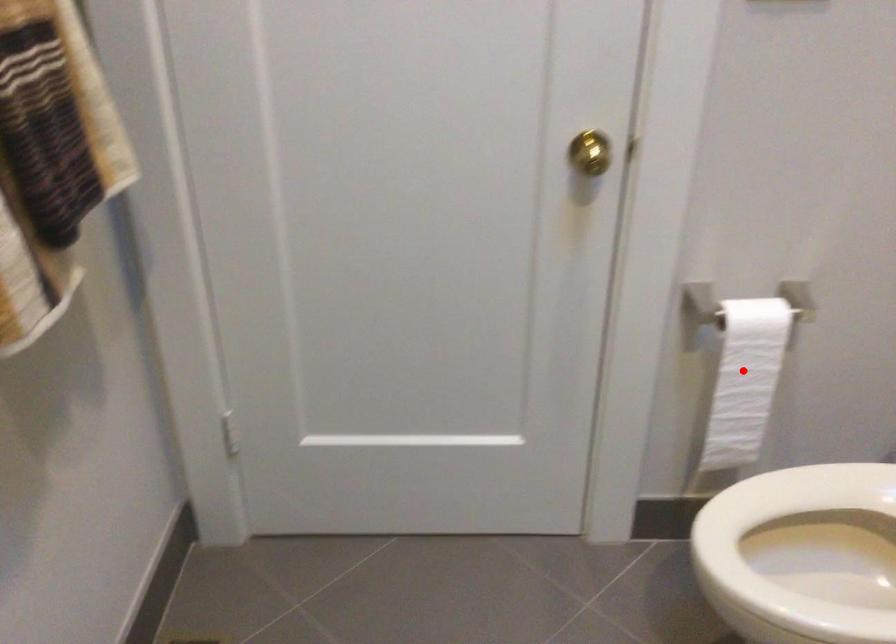
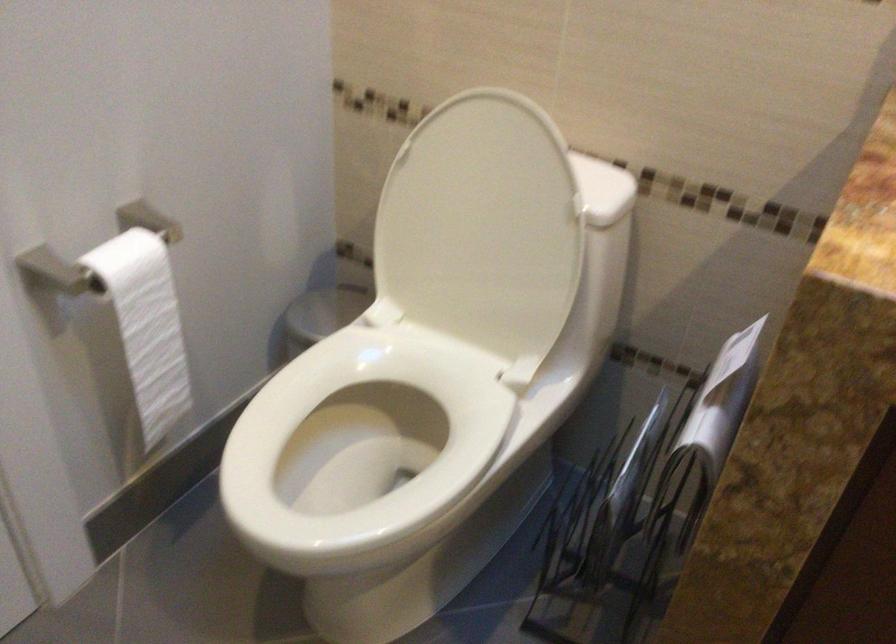
Question: I am providing you with two images of the same scene from different viewpoints. In image1, a red point is highlighted. Considering the same 3D point in image2, which of the following is correct?

Choices:
 (A) It is closer
 (B) It is farther

Answer: (A)